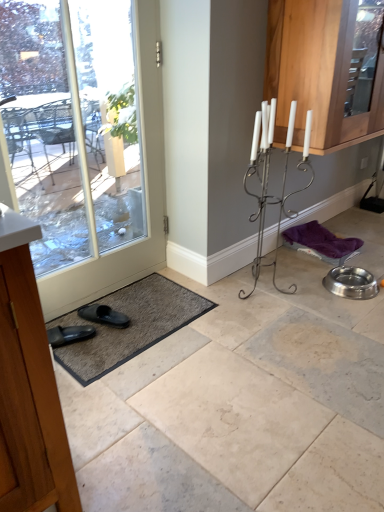
Question: From a real-world perspective, is clear glass door at lower left physically below black rubber slipper at lower left?

Choices:
 (A) yes
 (B) no

Answer: (B)

Question: Considering the relative sizes of clear glass door at lower left and black rubber slipper at lower left in the image provided, is clear glass door at lower left smaller than black rubber slipper at lower left?

Choices:
 (A) no
 (B) yes

Answer: (A)

Question: From a real-world perspective, is clear glass door at lower left located higher than black rubber slipper at lower left?

Choices:
 (A) yes
 (B) no

Answer: (A)

Question: Is clear glass door at lower left facing towards black rubber slipper at lower left?

Choices:
 (A) yes
 (B) no

Answer: (A)

Question: From the image's perspective, is clear glass door at lower left above black rubber slipper at lower left?

Choices:
 (A) yes
 (B) no

Answer: (A)

Question: Considering the relative sizes of clear glass door at lower left and black rubber slipper at lower left in the image provided, is clear glass door at lower left thinner than black rubber slipper at lower left?

Choices:
 (A) yes
 (B) no

Answer: (A)

Question: Does wooden cabinet at left, the 1th cabinetry viewed from the left, have a greater width compared to wooden cabinet at upper right, acting as the 1th cabinetry starting from the back?

Choices:
 (A) no
 (B) yes

Answer: (B)

Question: Is wooden cabinet at left, which is counted as the first cabinetry, starting from the front, at the left side of wooden cabinet at upper right, the second cabinetry positioned from the bottom?

Choices:
 (A) yes
 (B) no

Answer: (A)

Question: Is wooden cabinet at left, placed as the second cabinetry when sorted from back to front, positioned with its back to wooden cabinet at upper right, the second cabinetry when ordered from front to back?

Choices:
 (A) no
 (B) yes

Answer: (A)

Question: Is wooden cabinet at left, the 1th cabinetry viewed from the left, oriented towards wooden cabinet at upper right, the second cabinetry when ordered from front to back?

Choices:
 (A) yes
 (B) no

Answer: (B)

Question: Is there a large distance between wooden cabinet at left, the 1th cabinetry viewed from the left, and wooden cabinet at upper right, the second cabinetry when ordered from front to back?

Choices:
 (A) yes
 (B) no

Answer: (A)

Question: Is wooden cabinet at left, which appears as the second cabinetry when viewed from the top, at the right side of wooden cabinet at upper right, acting as the first cabinetry starting from the right?

Choices:
 (A) no
 (B) yes

Answer: (A)

Question: Is gray textured bath mat at lower left facing towards clear glass door at lower left?

Choices:
 (A) yes
 (B) no

Answer: (B)